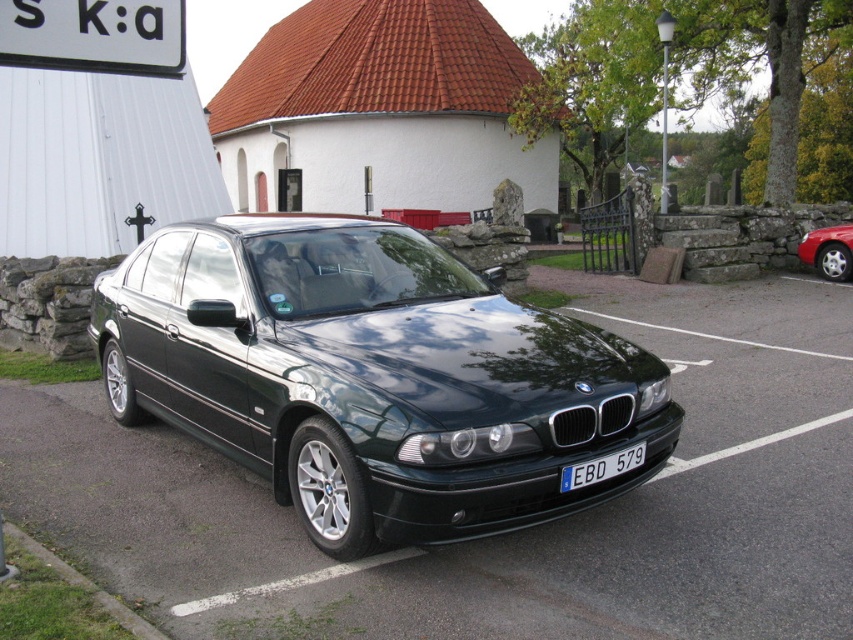
Which is below, metallic red car at right or blue metallic license plate at center?

blue metallic license plate at center is lower down.

Which of these two, metallic red car at right or blue metallic license plate at center, stands taller?

metallic red car at right is taller.

Does point (807, 250) come closer to viewer compared to point (610, 467)?

No, it is not.

Find the location of `metallic red car at right`. metallic red car at right is located at coordinates (828, 252).

Is white plastic sign at upper left wider than metallic red car at right?

Yes.

Can you confirm if white plastic sign at upper left is positioned to the left of metallic red car at right?

Indeed, white plastic sign at upper left is positioned on the left side of metallic red car at right.

Locate an element on the screen. The width and height of the screenshot is (853, 640). white plastic sign at upper left is located at coordinates (94, 35).

Where is `white plastic sign at upper left`? white plastic sign at upper left is located at coordinates (94, 35).

Consider the image. Is white plastic sign at upper left positioned at the back of blue metallic license plate at center?

No, white plastic sign at upper left is in front of blue metallic license plate at center.

Between point (68, 12) and point (595, 477), which one is positioned behind?

The point (595, 477) is behind.

This screenshot has width=853, height=640. Find the location of `white plastic sign at upper left`. white plastic sign at upper left is located at coordinates (94, 35).